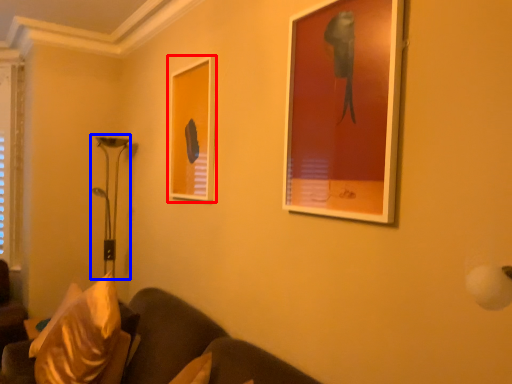
Question: Which of the following is the closest to the observer, picture frame (highlighted by a red box) or table lamp (highlighted by a blue box)?

Choices:
 (A) picture frame
 (B) table lamp

Answer: (A)